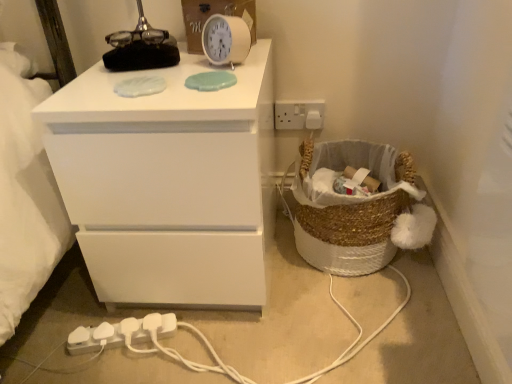
This screenshot has width=512, height=384. Find the location of `free space in front of white plastic extension cord at lower left`. free space in front of white plastic extension cord at lower left is located at coordinates pyautogui.click(x=115, y=371).